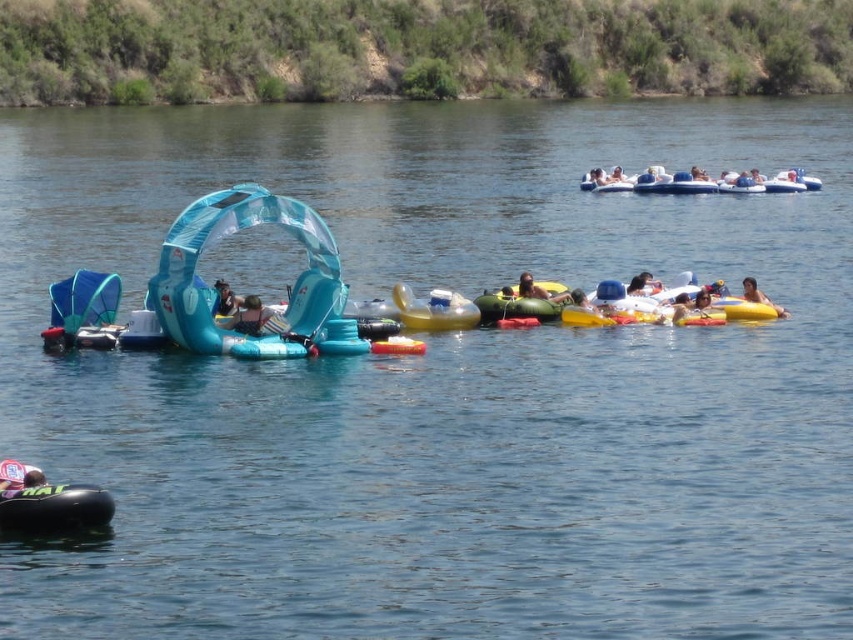
Question: Among these points, which one is farthest from the camera?

Choices:
 (A) (643, 288)
 (B) (750, 282)

Answer: (A)

Question: Which is nearer to the transparent plastic tent at upper center?

Choices:
 (A) white plastic cup at lower left
 (B) translucent rubber raft at center

Answer: (B)

Question: Which object is positioned closest to the smooth yellow float at right?

Choices:
 (A) matte blue inflatable at center
 (B) white plastic cup at lower left
 (C) transparent plastic tent at upper center
 (D) blue plastic chair at center

Answer: (D)

Question: In this image, where is blue plastic chair at center located relative to dark brown hair at center?

Choices:
 (A) below
 (B) above

Answer: (A)

Question: Does blue rubber raft at upper center lie behind green rubber raft at center?

Choices:
 (A) yes
 (B) no

Answer: (A)

Question: Can you confirm if matte blue inflatable at center is wider than yellow rubber boat at center-right?

Choices:
 (A) no
 (B) yes

Answer: (A)